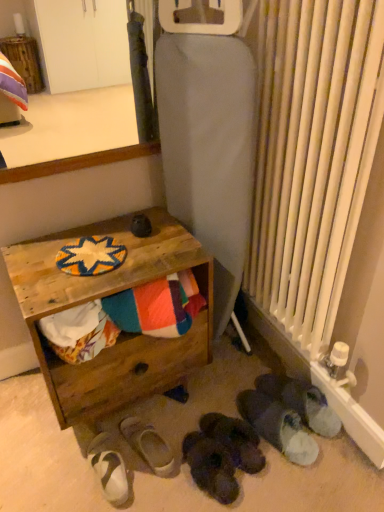
You are a GUI agent. You are given a task and a screenshot of the screen. Output one action in this format:
    pyautogui.click(x=<x>, y=<y>)
    Task: Click on the free space in front of white fuzzy slippers at lower right, which is the second footwear from right to left
    
    Given the screenshot: What is the action you would take?
    coord(288,485)